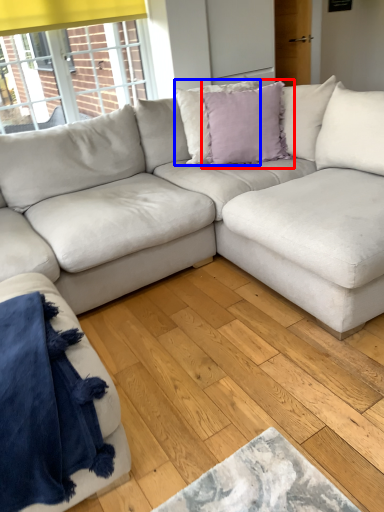
Question: Which point is further to the camera, pillow (highlighted by a red box) or pillow (highlighted by a blue box)?

Choices:
 (A) pillow
 (B) pillow

Answer: (B)